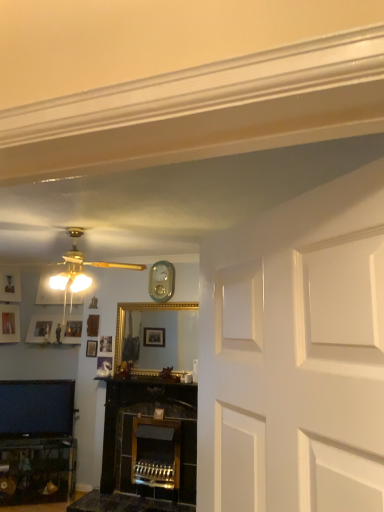
Question: In the image, is matte silver picture frame at left, placed as the 1th picture frame when sorted from left to right, on the left side or the right side of matte black tv at lower left?

Choices:
 (A) left
 (B) right

Answer: (A)

Question: In terms of size, does matte silver picture frame at left, the 2th picture frame when ordered from front to back, appear bigger or smaller than matte black tv at lower left?

Choices:
 (A) small
 (B) big

Answer: (A)

Question: Estimate the real-world distances between objects in this image. Which object is closer to the matte silver picture frame at left, arranged as the second picture frame when viewed from the back?

Choices:
 (A) matte silver picture frame at upper left, which ranks as the 1th picture frame in back-to-front order
 (B) matte gold ceiling fan at upper left
 (C) matte black tv at lower left
 (D) wooden picture frame at upper left, the first picture frame viewed from the front
 (E) teal glossy clock at upper center

Answer: (A)

Question: Estimate the real-world distances between objects in this image. Which object is closer to the matte silver picture frame at upper left, the third picture frame from the front?

Choices:
 (A) matte gold ceiling fan at upper left
 (B) teal glossy clock at upper center
 (C) matte black tv at lower left
 (D) wooden picture frame at upper left, the 3th picture frame viewed from the back
 (E) matte silver picture frame at left, placed as the 1th picture frame when sorted from left to right

Answer: (E)